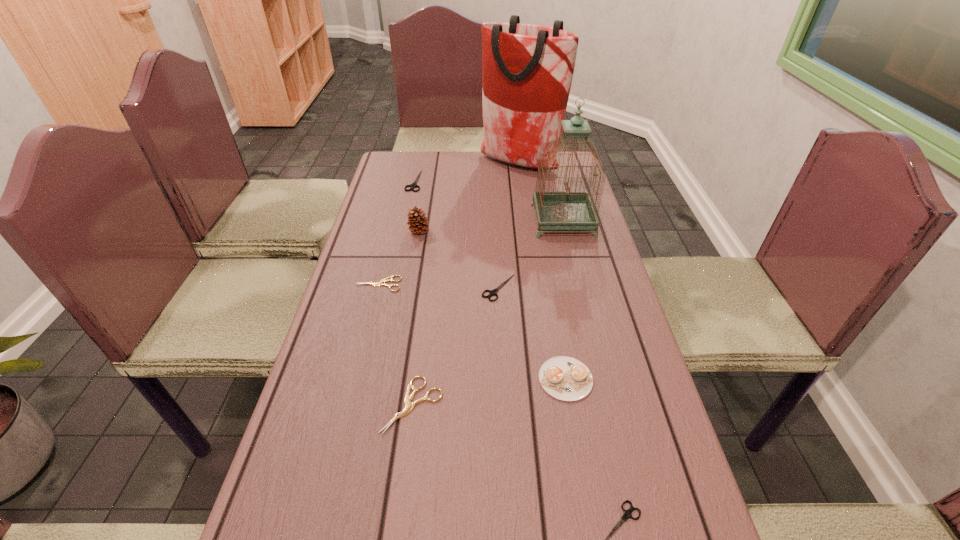
Locate an element on the screen. unoccupied area between the seventh shortest object and the farthest shears is located at coordinates (417, 206).

Locate which object ranks seventh in proximity to the third tallest object. Please provide its 2D coordinates. Your answer should be formatted as a tuple, i.e. [(x, y)], where the tuple contains the x and y coordinates of a point satisfying the conditions above.

[(565, 378)]

Image resolution: width=960 pixels, height=540 pixels. Find the location of `object that is the eighth closest to the third shears from right to left`. object that is the eighth closest to the third shears from right to left is located at coordinates (527, 70).

The height and width of the screenshot is (540, 960). Find the location of `shears object that ranks as the fourth closest to the cappuccino`. shears object that ranks as the fourth closest to the cappuccino is located at coordinates (380, 283).

Find the location of a particular element. shears that is the third closest to the birdcage is located at coordinates (380, 283).

You are a GUI agent. You are given a task and a screenshot of the screen. Output one action in this format:
    pyautogui.click(x=<x>, y=<y>)
    Task: Click on the black shears that is the closest to the fourth shears from left to right
    Image resolution: width=960 pixels, height=540 pixels.
    Given the screenshot: What is the action you would take?
    pyautogui.click(x=414, y=185)

Find the location of a particular element. The width and height of the screenshot is (960, 540). the closest black shears to the eighth shortest object is located at coordinates (493, 292).

Where is `beige shears that is the second closest to the pinecone`? The width and height of the screenshot is (960, 540). beige shears that is the second closest to the pinecone is located at coordinates (409, 406).